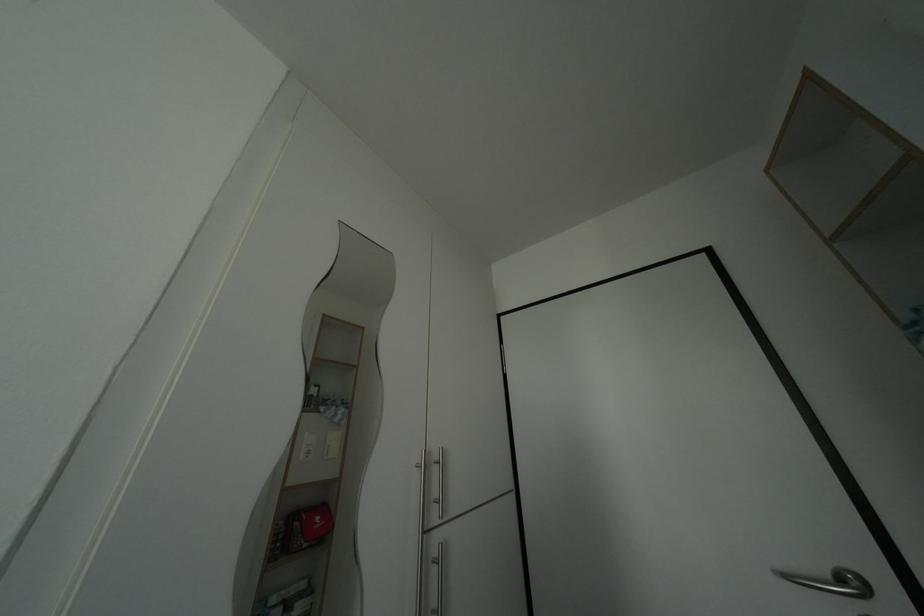
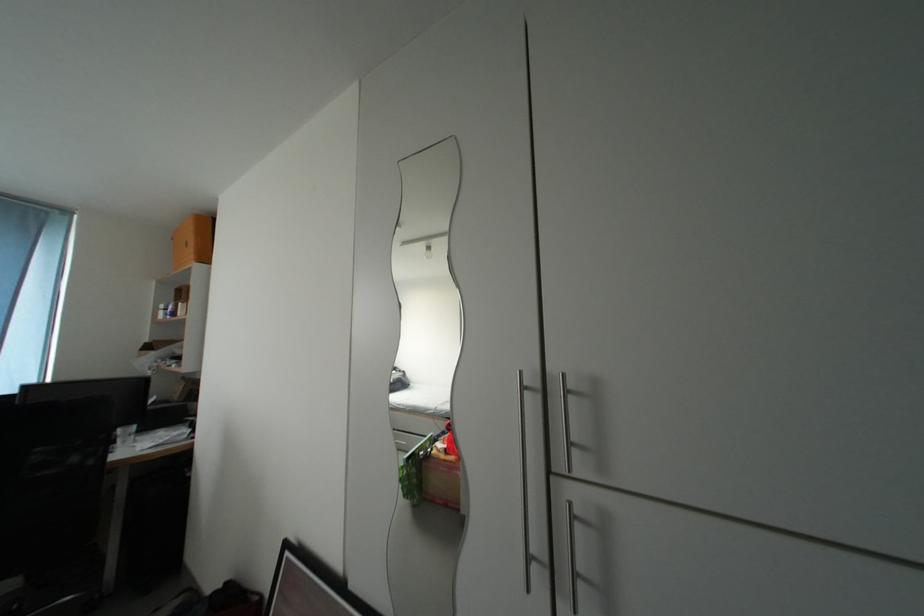
Question: The first image is from the beginning of the video and the second image is from the end. How did the camera likely rotate when shooting the video?

Choices:
 (A) Left
 (B) Right
 (C) Up
 (D) Down

Answer: (A)